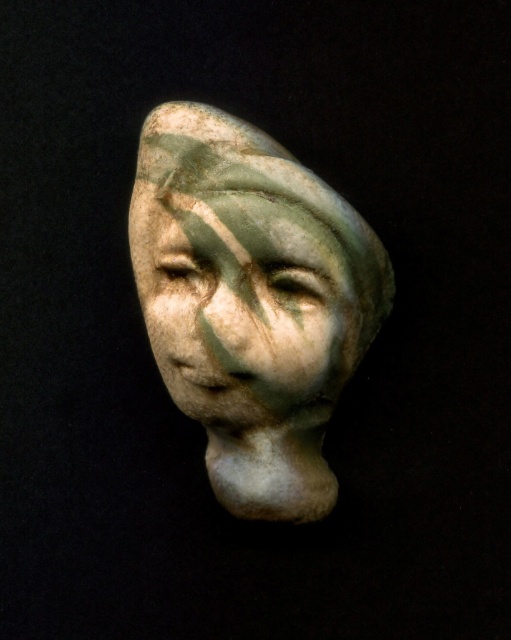
Between green marble head at center and matte green stone face at center, which one has more height?

green marble head at center is taller.

Which is in front, point (258, 200) or point (290, 372)?

Point (258, 200) is more forward.

The width and height of the screenshot is (511, 640). Describe the element at coordinates (251, 301) in the screenshot. I see `green marble head at center` at that location.

Image resolution: width=511 pixels, height=640 pixels. I want to click on green marble head at center, so click(x=251, y=301).